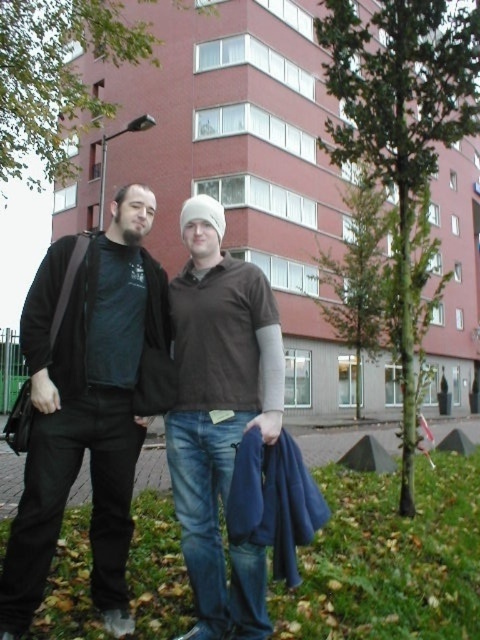
You are trying to figure out who is closer to the camera between the two people in the image. The black matte jacket at left and the brown cotton shirt at center are both visible. Based on their positions, which one is closer to the camera?

The black matte jacket at left is in front of the brown cotton shirt at center, so the black matte jacket at left is closer to the camera.

You are trying to locate the black matte jacket at left in the image. According to the coordinates provided, where exactly is it positioned?

The black matte jacket at left is located at point 0.636 along the x axis and 0.181 along the y axis.